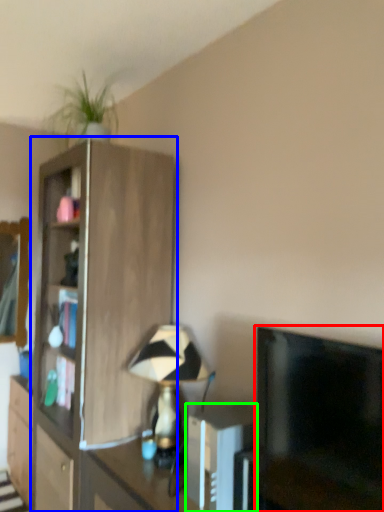
Question: Estimate the real-world distances between objects in this image. Which object is closer to television (highlighted by a red box), cupboard (highlighted by a blue box) or appliance (highlighted by a green box)?

Choices:
 (A) cupboard
 (B) appliance

Answer: (B)